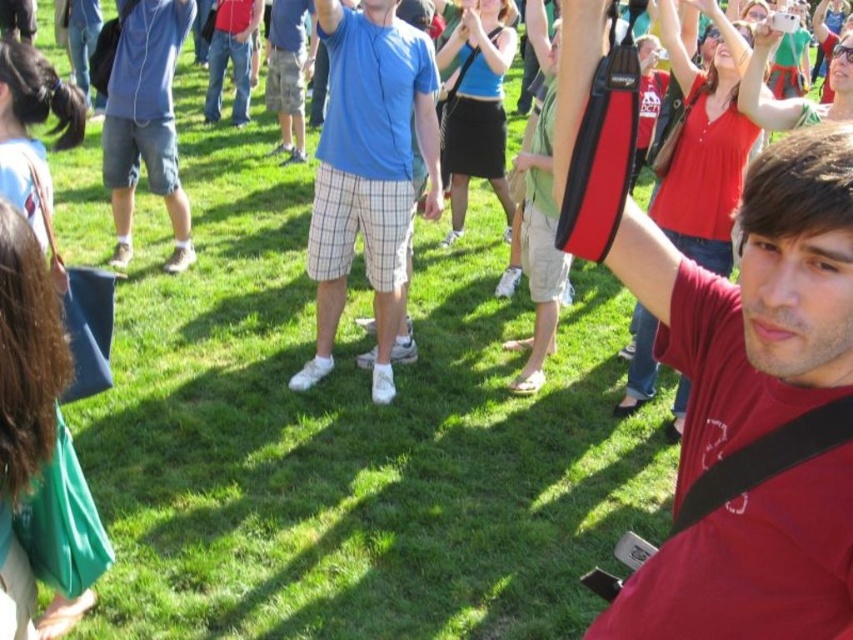
Who is positioned more to the left, matte red shirt at center or denim shorts at left?

From the viewer's perspective, denim shorts at left appears more on the left side.

Does matte red shirt at center appear on the right side of denim shorts at left?

Correct, you'll find matte red shirt at center to the right of denim shorts at left.

Between point (654, 621) and point (184, 221), which one is positioned behind?

The point (184, 221) is behind.

Find the location of a particular element. The height and width of the screenshot is (640, 853). matte red shirt at center is located at coordinates (755, 300).

Is matte red shirt at center positioned at the back of blue cotton shirt at center?

That is False.

In the scene shown: Is matte red shirt at center smaller than blue cotton shirt at center?

Yes.

Locate an element on the screen. matte red shirt at center is located at coordinates (755, 300).

At what (x,y) coordinates should I click in order to perform the action: click on matte red shirt at center. Please return your answer as a coordinate pair (x, y). Looking at the image, I should click on (755, 300).

Can you confirm if blue cotton shirt at center is shorter than denim shorts at left?

Incorrect, blue cotton shirt at center's height does not fall short of denim shorts at left's.

Find the location of a particular element. blue cotton shirt at center is located at coordinates (368, 172).

What are the coordinates of `blue cotton shirt at center` in the screenshot? It's located at 368,172.